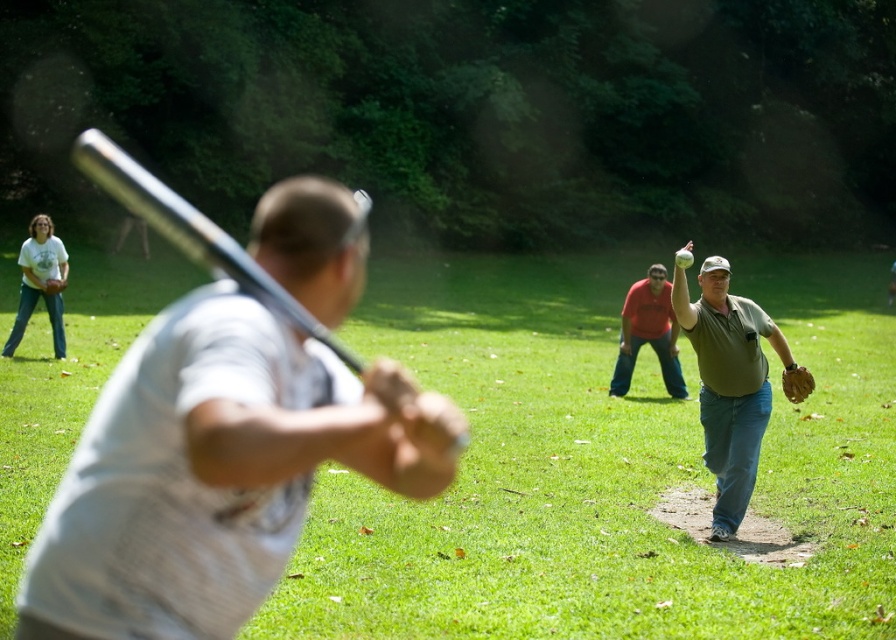
Between point (307, 188) and point (229, 250), which one is positioned behind?

Point (307, 188)

Is point (293, 257) positioned before point (220, 241)?

No.

Locate an element on the screen. white matte bat at center is located at coordinates (214, 470).

I want to click on white matte bat at center, so click(x=214, y=470).

Can you confirm if matte red shirt at center is positioned to the left of brown leather baseball glove at right?

Yes, matte red shirt at center is to the left of brown leather baseball glove at right.

The image size is (896, 640). What do you see at coordinates (648, 332) in the screenshot?
I see `matte red shirt at center` at bounding box center [648, 332].

Between point (668, 326) and point (804, 368), which one is positioned behind?

Positioned behind is point (668, 326).

You are a GUI agent. You are given a task and a screenshot of the screen. Output one action in this format:
    pyautogui.click(x=<x>, y=<y>)
    Task: Click on the matte red shirt at center
    This screenshot has width=896, height=640.
    Given the screenshot: What is the action you would take?
    pyautogui.click(x=648, y=332)

Measure the distance between point (587,458) and camera.

37.68 feet

Is matte white baseball bat at center behind matte white t-shirt at left?

That is False.

You are a GUI agent. You are given a task and a screenshot of the screen. Output one action in this format:
    pyautogui.click(x=<x>, y=<y>)
    Task: Click on the matte white baseball bat at center
    
    Given the screenshot: What is the action you would take?
    pyautogui.click(x=602, y=465)